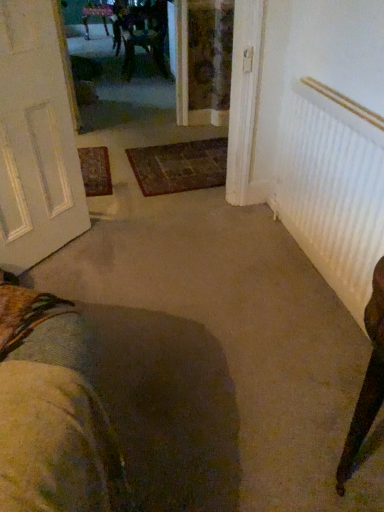
Question: Is wooden chair at upper center wider or thinner than carpeted doormat at center?

Choices:
 (A) wide
 (B) thin

Answer: (B)

Question: From a real-world perspective, is wooden chair at upper center physically located above or below carpeted doormat at center?

Choices:
 (A) above
 (B) below

Answer: (A)

Question: Based on their relative distances, which object is nearer to the carpeted doormat at center?

Choices:
 (A) white textured door at left
 (B) white ribbed radiator at right
 (C) wooden chair at upper center

Answer: (A)

Question: Estimate the real-world distances between objects in this image. Which object is closer to the white ribbed radiator at right?

Choices:
 (A) carpeted doormat at center
 (B) wooden chair at upper center
 (C) white textured door at left

Answer: (A)